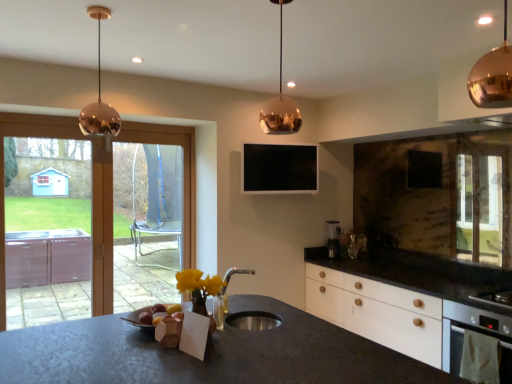
Question: Considering the relative sizes of copper metallic pendant light at upper center, acting as the second lamp starting from the front, and satin silver coffee machine at right in the image provided, is copper metallic pendant light at upper center, acting as the second lamp starting from the front, smaller than satin silver coffee machine at right?

Choices:
 (A) no
 (B) yes

Answer: (A)

Question: From a real-world perspective, is copper metallic pendant light at upper center, acting as the second lamp starting from the front, on top of satin silver coffee machine at right?

Choices:
 (A) yes
 (B) no

Answer: (A)

Question: Is copper metallic pendant light at upper center, placed as the second lamp when sorted from right to left, far from satin silver coffee machine at right?

Choices:
 (A) yes
 (B) no

Answer: (A)

Question: Can you confirm if copper metallic pendant light at upper center, placed as the second lamp when sorted from right to left, is thinner than satin silver coffee machine at right?

Choices:
 (A) yes
 (B) no

Answer: (B)

Question: Does copper metallic pendant light at upper center, the 2th lamp when ordered from left to right, touch satin silver coffee machine at right?

Choices:
 (A) no
 (B) yes

Answer: (A)

Question: Considering the positions of transparent glass screen door at left, the 2th screen door when ordered from back to front, and transparent glass door at left in the image, is transparent glass screen door at left, the 2th screen door when ordered from back to front, bigger or smaller than transparent glass door at left?

Choices:
 (A) small
 (B) big

Answer: (A)

Question: From a real-world perspective, relative to transparent glass door at left, is transparent glass screen door at left, positioned as the first screen door in left-to-right order, vertically above or below?

Choices:
 (A) above
 (B) below

Answer: (A)

Question: Choose the correct answer: Is transparent glass screen door at left, which is the second screen door from right to left, inside transparent glass door at left or outside it?

Choices:
 (A) outside
 (B) inside

Answer: (B)

Question: From the image's perspective, is transparent glass screen door at left, positioned as the first screen door in left-to-right order, positioned above or below transparent glass door at left?

Choices:
 (A) above
 (B) below

Answer: (A)

Question: Considering the positions of point (175, 244) and point (480, 82), is point (175, 244) closer or farther from the camera than point (480, 82)?

Choices:
 (A) closer
 (B) farther

Answer: (B)

Question: Would you say clear glass screen door at left, which is the 2th screen door in front-to-back order, is inside or outside copper/metallic pendant light at upper right, which is the first lamp from right to left?

Choices:
 (A) outside
 (B) inside

Answer: (A)

Question: In terms of height, does clear glass screen door at left, which is the 2th screen door in front-to-back order, look taller or shorter compared to copper/metallic pendant light at upper right, positioned as the 3th lamp in back-to-front order?

Choices:
 (A) short
 (B) tall

Answer: (B)

Question: In the image, is clear glass screen door at left, acting as the 1th screen door starting from the back, on the left side or the right side of copper/metallic pendant light at upper right, which is the first lamp from right to left?

Choices:
 (A) left
 (B) right

Answer: (A)

Question: In terms of width, does white matte oven at lower right look wider or thinner when compared to copper/metallic pendant light at upper left, the 3th lamp when ordered from right to left?

Choices:
 (A) wide
 (B) thin

Answer: (B)

Question: Is white matte oven at lower right inside the boundaries of copper/metallic pendant light at upper left, the 3th lamp when ordered from right to left, or outside?

Choices:
 (A) inside
 (B) outside

Answer: (B)